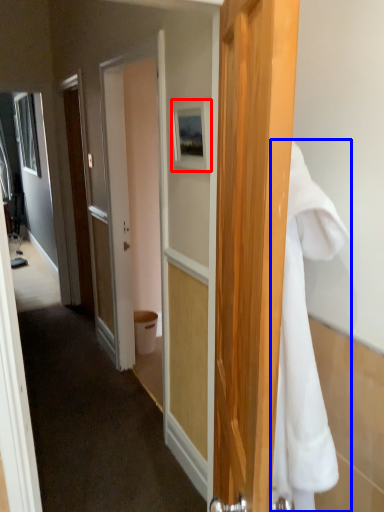
Question: Which point is further to the camera, picture frame (highlighted by a red box) or towel/napkin (highlighted by a blue box)?

Choices:
 (A) picture frame
 (B) towel/napkin

Answer: (A)